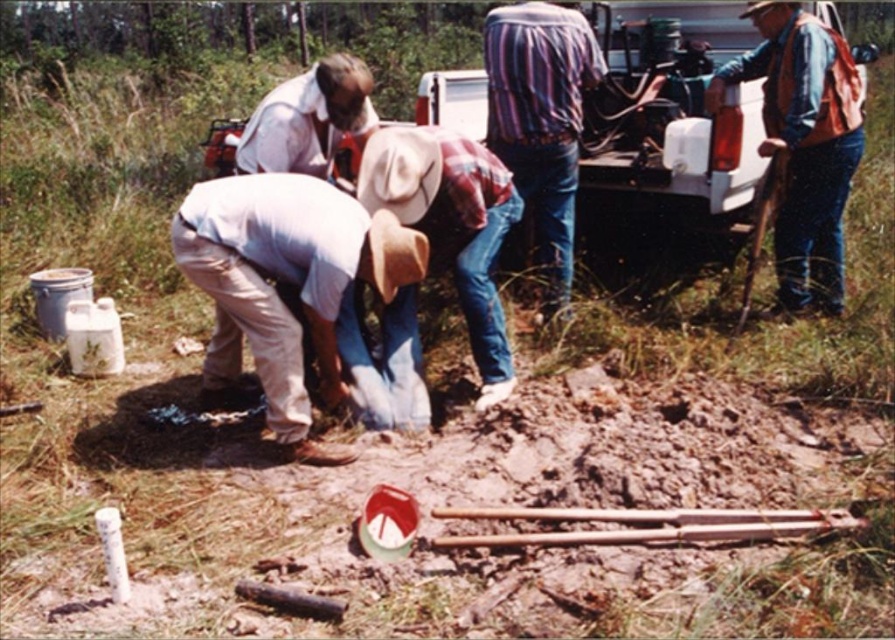
Does white plastic truck at upper right have a smaller size compared to brown canvas safety vest at right?

Actually, white plastic truck at upper right might be larger than brown canvas safety vest at right.

Measure the distance between white plastic truck at upper right and camera.

They are 4.87 meters apart.

Identify the location of white plastic truck at upper right. (667, 125).

Does brown canvas safety vest at right appear on the right side of matte white shirt at center?

Indeed, brown canvas safety vest at right is positioned on the right side of matte white shirt at center.

Is brown canvas safety vest at right to the left of matte white shirt at center from the viewer's perspective?

In fact, brown canvas safety vest at right is to the right of matte white shirt at center.

Is point (837, 179) farther from viewer compared to point (350, 108)?

Yes, it is behind point (350, 108).

This screenshot has width=895, height=640. I want to click on brown canvas safety vest at right, so click(803, 144).

How far apart are brown canvas safety vest at right and white cotton shirt at center?

brown canvas safety vest at right is 1.81 meters away from white cotton shirt at center.

Between brown canvas safety vest at right and white cotton shirt at center, which one appears on the right side from the viewer's perspective?

brown canvas safety vest at right is more to the right.

Is point (808, 205) positioned before point (465, 170)?

No, (808, 205) is behind (465, 170).

Locate an element on the screen. The image size is (895, 640). brown canvas safety vest at right is located at coordinates (803, 144).